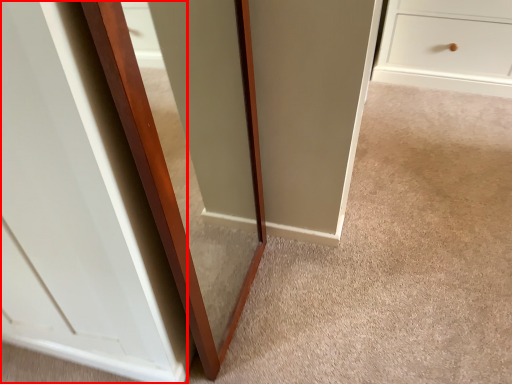
Question: From the image's perspective, what is the correct spatial relationship of glass door (annotated by the red box) in relation to glass door?

Choices:
 (A) below
 (B) above

Answer: (B)